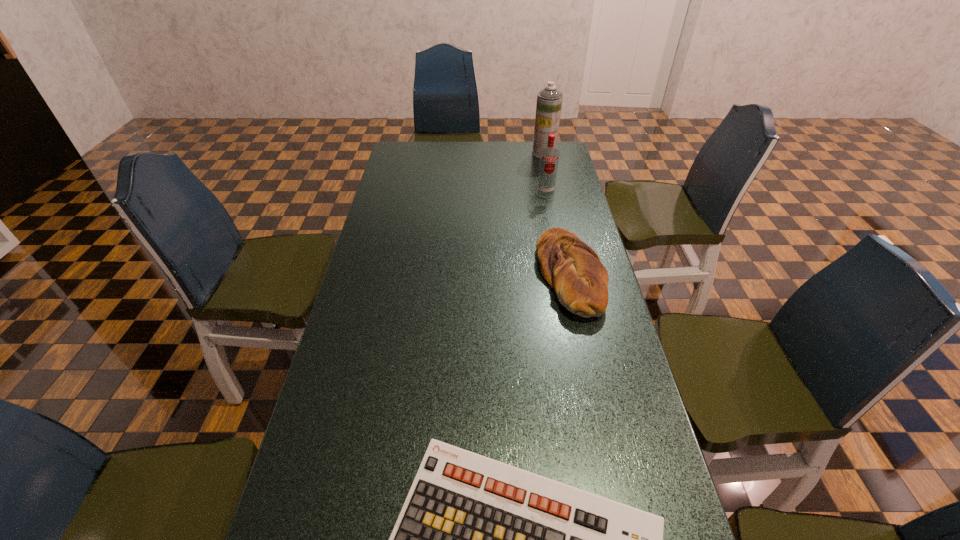
Find the location of a particular element. aerosol can is located at coordinates (549, 100).

Where is `the tallest object`? Image resolution: width=960 pixels, height=540 pixels. the tallest object is located at coordinates (549, 100).

Find the location of `the second tallest object`. the second tallest object is located at coordinates (549, 156).

Image resolution: width=960 pixels, height=540 pixels. Find the location of `vodka`. vodka is located at coordinates (549, 156).

Where is `bread`? bread is located at coordinates (573, 269).

Locate an element on the screen. The image size is (960, 540). the second shortest object is located at coordinates (573, 269).

At what (x,y) coordinates should I click in order to perform the action: click on vacant space located 0.260m on the left of the farthest object. Please return your answer as a coordinate pair (x, y). This screenshot has width=960, height=540. Looking at the image, I should click on (471, 153).

At what (x,y) coordinates should I click in order to perform the action: click on vacant space located 0.360m on the front label of the third shortest object. Please return your answer as a coordinate pair (x, y). The image size is (960, 540). Looking at the image, I should click on (559, 259).

You are a GUI agent. You are given a task and a screenshot of the screen. Output one action in this format:
    pyautogui.click(x=<x>, y=<y>)
    Task: Click on the vacant space located on the back of the third farthest object
    The width and height of the screenshot is (960, 540).
    Given the screenshot: What is the action you would take?
    pyautogui.click(x=558, y=218)

Identify the location of object at the far edge. This screenshot has width=960, height=540. (549, 100).